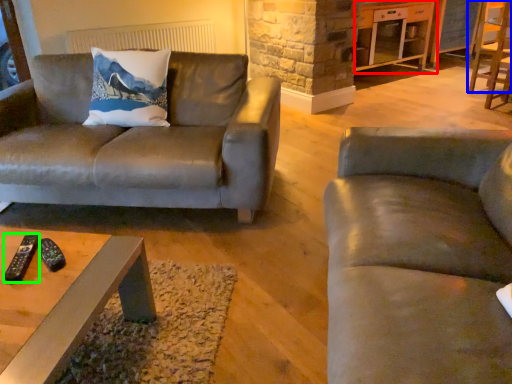
Question: Based on their relative distances, which object is farther from entertainment center (highlighted by a red box)? Choose from chair (highlighted by a blue box) and remote (highlighted by a green box).

Choices:
 (A) chair
 (B) remote

Answer: (B)